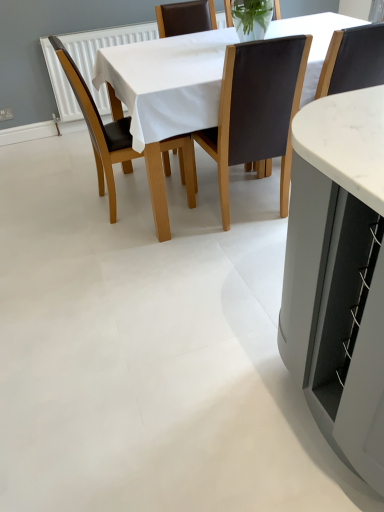
What is the approximate width of brown leather chair at center, arranged as the 1th chair when viewed from the left?

brown leather chair at center, arranged as the 1th chair when viewed from the left, is 17.63 inches wide.

The width and height of the screenshot is (384, 512). I want to click on brown leather chair at center, acting as the second chair starting from the right, so click(x=257, y=109).

Is brown leather chair at center, arranged as the 1th chair when viewed from the left, surrounding black leather chair at center, the 3th chair viewed from the left?

No, black leather chair at center, the 3th chair viewed from the left, is not a part of brown leather chair at center, arranged as the 1th chair when viewed from the left.

Can you confirm if brown leather chair at center, arranged as the 3th chair when viewed from the right, is wider than black leather chair at center, the 3th chair viewed from the left?

Yes.

How different are the orientations of brown leather chair at center, arranged as the 3th chair when viewed from the right, and black leather chair at center, acting as the 1th chair starting from the right, in degrees?

There is a 85.1-degree angle between the facing directions of brown leather chair at center, arranged as the 3th chair when viewed from the right, and black leather chair at center, acting as the 1th chair starting from the right.

From the image's perspective, which one is positioned lower, brown leather chair at center, arranged as the 3th chair when viewed from the right, or black leather chair at center, acting as the 1th chair starting from the right?

brown leather chair at center, arranged as the 3th chair when viewed from the right.

From the image's perspective, which object appears higher, white fabric table at center or black leather chair at center, acting as the 1th chair starting from the right?

black leather chair at center, acting as the 1th chair starting from the right, appears higher in the image.

Measure the distance between white fabric table at center and black leather chair at center, acting as the 1th chair starting from the right.

white fabric table at center and black leather chair at center, acting as the 1th chair starting from the right, are 64.57 centimeters apart from each other.

Where is `chair located on the right of white fabric table at center`? The height and width of the screenshot is (512, 384). chair located on the right of white fabric table at center is located at coordinates (353, 60).

Is brown leather chair at center, positioned as the second chair in left-to-right order, not near black leather chair at center, the 3th chair viewed from the left?

No, brown leather chair at center, positioned as the second chair in left-to-right order, is in close proximity to black leather chair at center, the 3th chair viewed from the left.

How far apart are brown leather chair at center, acting as the second chair starting from the right, and black leather chair at center, acting as the 1th chair starting from the right?

They are 11.39 inches apart.

Looking at this image, how different are the orientations of brown leather chair at center, positioned as the second chair in left-to-right order, and black leather chair at center, the 3th chair viewed from the left, in degrees?

The angle between the facing direction of brown leather chair at center, positioned as the second chair in left-to-right order, and the facing direction of black leather chair at center, the 3th chair viewed from the left, is 0.000134 degrees.

The width and height of the screenshot is (384, 512). I want to click on the 1st chair to the left when counting from the black leather chair at center, acting as the 1th chair starting from the right, so click(257, 109).

This screenshot has height=512, width=384. What are the coordinates of `kitchen & dining room table behind the brown leather chair at center, positioned as the second chair in left-to-right order` in the screenshot? It's located at (165, 96).

Considering the points (205, 96) and (265, 148), which point is in front, point (205, 96) or point (265, 148)?

The point (205, 96) is closer.

Is white fabric table at center positioned with its back to brown leather chair at center, positioned as the second chair in left-to-right order?

Yes, white fabric table at center is facing away from brown leather chair at center, positioned as the second chair in left-to-right order.

From a real-world perspective, is white fabric table at center positioned above or below brown leather chair at center, positioned as the second chair in left-to-right order?

white fabric table at center is situated lower than brown leather chair at center, positioned as the second chair in left-to-right order, in the real world.

Could you measure the distance between white fabric table at center and brown leather chair at center, arranged as the 3th chair when viewed from the right?

white fabric table at center and brown leather chair at center, arranged as the 3th chair when viewed from the right, are 28.86 centimeters apart.

Considering the relative sizes of white fabric table at center and brown leather chair at center, arranged as the 1th chair when viewed from the left, in the image provided, is white fabric table at center bigger than brown leather chair at center, arranged as the 1th chair when viewed from the left,?

Correct, white fabric table at center is larger in size than brown leather chair at center, arranged as the 1th chair when viewed from the left.

In the scene shown: Which point is more forward, (181, 76) or (133, 158)?

Positioned in front is point (181, 76).

Is brown leather chair at center, arranged as the 3th chair when viewed from the right, surrounded by white fabric table at center?

Yes, brown leather chair at center, arranged as the 3th chair when viewed from the right, can be found within white fabric table at center.

Which is less distant, (x=263, y=117) or (x=183, y=70)?

Point (x=183, y=70)

Is white fabric table at center surrounded by brown leather chair at center, positioned as the second chair in left-to-right order?

No, white fabric table at center is located outside of brown leather chair at center, positioned as the second chair in left-to-right order.

Is the depth of brown leather chair at center, positioned as the second chair in left-to-right order, greater than that of white fabric table at center?

No, brown leather chair at center, positioned as the second chair in left-to-right order, is in front of white fabric table at center.

Considering the relative sizes of black leather chair at center, the 3th chair viewed from the left, and white fabric table at center in the image provided, is black leather chair at center, the 3th chair viewed from the left, shorter than white fabric table at center?

Indeed, black leather chair at center, the 3th chair viewed from the left, has a lesser height compared to white fabric table at center.

Is black leather chair at center, acting as the 1th chair starting from the right, wider than white fabric table at center?

No.

At what (x,y) coordinates should I click in order to perform the action: click on kitchen & dining room table below the black leather chair at center, the 3th chair viewed from the left (from the image's perspective). Please return your answer as a coordinate pair (x, y). Looking at the image, I should click on (165, 96).

Based on the photo, how many degrees apart are the facing directions of black leather chair at center, acting as the 1th chair starting from the right, and white fabric table at center?

There is a 178-degree angle between the facing directions of black leather chair at center, acting as the 1th chair starting from the right, and white fabric table at center.

This screenshot has width=384, height=512. What are the coordinates of `the 2nd chair counting from the left side of the black leather chair at center, acting as the 1th chair starting from the right` in the screenshot? It's located at 128,149.

Locate an element on the screen. the 1st chair behind the white fabric table at center, starting your count from the anchor is located at coordinates (353, 60).

Considering their positions, is brown leather chair at center, arranged as the 1th chair when viewed from the left, positioned closer to white fabric table at center than brown leather chair at center, positioned as the second chair in left-to-right order?

brown leather chair at center, arranged as the 1th chair when viewed from the left.

Considering their positions, is white fabric table at center positioned further to black leather chair at center, acting as the 1th chair starting from the right, than brown leather chair at center, arranged as the 1th chair when viewed from the left?

Based on the image, brown leather chair at center, arranged as the 1th chair when viewed from the left, appears to be further to black leather chair at center, acting as the 1th chair starting from the right.

From the image, which object appears to be nearer to brown leather chair at center, positioned as the second chair in left-to-right order, white fabric table at center or brown leather chair at center, arranged as the 1th chair when viewed from the left?

The object closer to brown leather chair at center, positioned as the second chair in left-to-right order, is white fabric table at center.

Looking at the image, which one is located further to black leather chair at center, acting as the 1th chair starting from the right, brown leather chair at center, arranged as the 1th chair when viewed from the left, or brown leather chair at center, positioned as the second chair in left-to-right order?

brown leather chair at center, arranged as the 1th chair when viewed from the left, lies further to black leather chair at center, acting as the 1th chair starting from the right, than the other object.

Which object lies further to the anchor point black leather chair at center, the 3th chair viewed from the left, white fabric table at center or brown leather chair at center, acting as the second chair starting from the right?

white fabric table at center.

Based on their spatial positions, is brown leather chair at center, arranged as the 3th chair when viewed from the right, or white fabric table at center closer to black leather chair at center, the 3th chair viewed from the left?

Based on the image, white fabric table at center appears to be nearer to black leather chair at center, the 3th chair viewed from the left.

Which object lies nearer to the anchor point brown leather chair at center, arranged as the 3th chair when viewed from the right, white fabric table at center or brown leather chair at center, positioned as the second chair in left-to-right order?

Based on the image, white fabric table at center appears to be nearer to brown leather chair at center, arranged as the 3th chair when viewed from the right.

From the image, which object appears to be nearer to brown leather chair at center, arranged as the 3th chair when viewed from the right, white fabric table at center or black leather chair at center, acting as the 1th chair starting from the right?

The object closer to brown leather chair at center, arranged as the 3th chair when viewed from the right, is white fabric table at center.

Where is `kitchen & dining room table located between brown leather chair at center, arranged as the 1th chair when viewed from the left, and black leather chair at center, acting as the 1th chair starting from the right, in the left-right direction`? kitchen & dining room table located between brown leather chair at center, arranged as the 1th chair when viewed from the left, and black leather chair at center, acting as the 1th chair starting from the right, in the left-right direction is located at coordinates (165, 96).

Identify the location of chair between brown leather chair at center, arranged as the 3th chair when viewed from the right, and black leather chair at center, the 3th chair viewed from the left, from left to right. (257, 109).

The width and height of the screenshot is (384, 512). I want to click on kitchen & dining room table located between brown leather chair at center, positioned as the second chair in left-to-right order, and black leather chair at center, acting as the 1th chair starting from the right, in the left-right direction, so click(x=165, y=96).

Identify the location of chair situated between brown leather chair at center, arranged as the 3th chair when viewed from the right, and white fabric table at center from left to right. This screenshot has width=384, height=512. (257, 109).